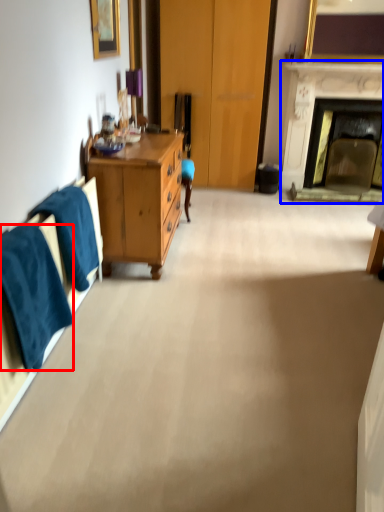
Question: Which object is closer to the camera taking this photo, towel/napkin (highlighted by a red box) or fireplace (highlighted by a blue box)?

Choices:
 (A) towel/napkin
 (B) fireplace

Answer: (A)